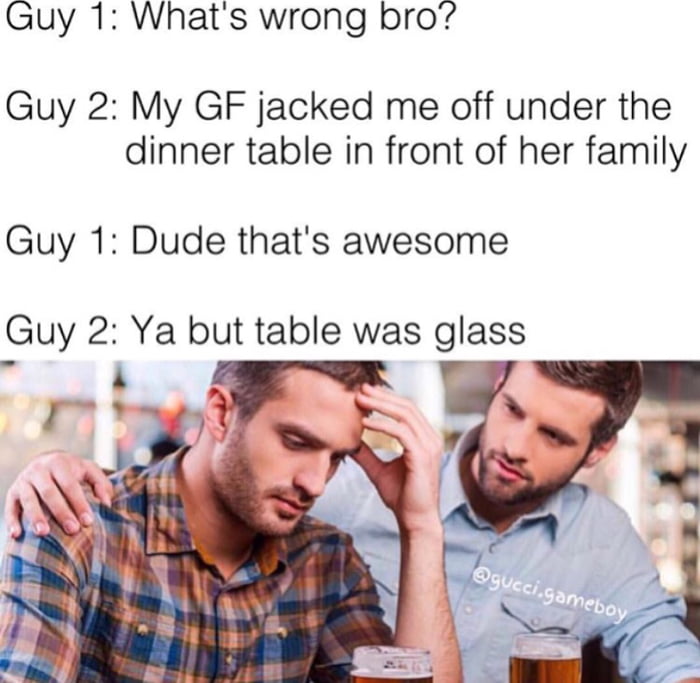
Where is `cup`? The height and width of the screenshot is (683, 700). cup is located at coordinates [x=395, y=665].